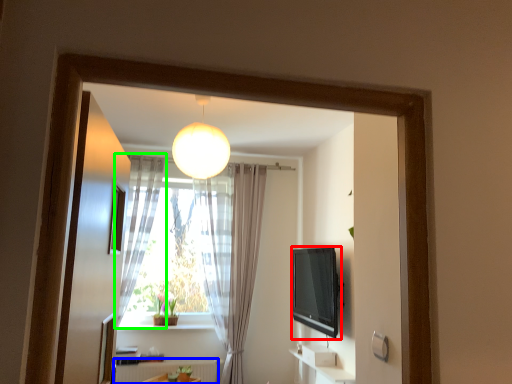
Question: Which object is the farthest from electronic (highlighted by a red box)? Choose among these: radiator (highlighted by a blue box) or curtain (highlighted by a green box).

Choices:
 (A) radiator
 (B) curtain

Answer: (B)